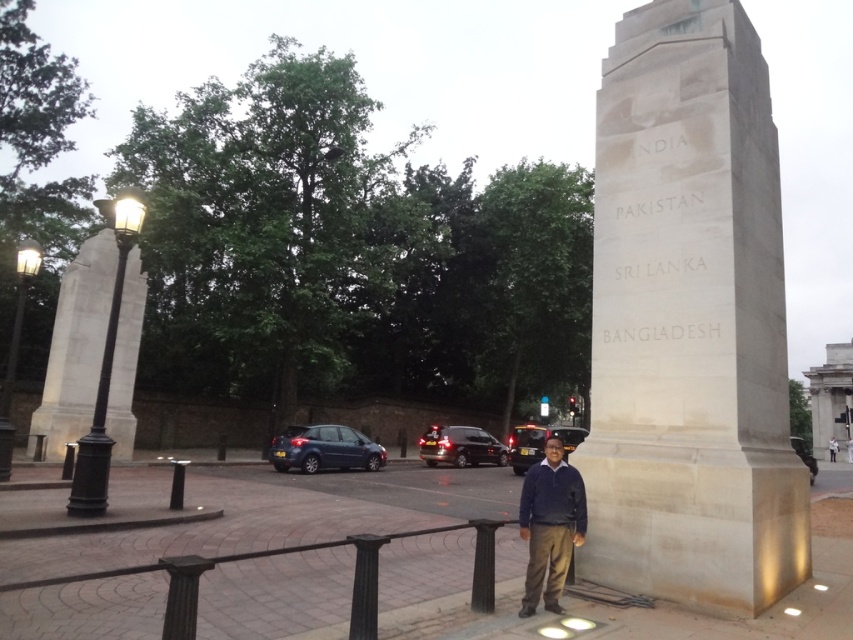
You are a tourist standing at the center of the pedestrian area and want to take a photo of the white stone monument at right. Considering your current position, which direction should you face to capture the monument in your camera frame?

A: Since the white stone monument at right is located at point (689, 321), you should face towards the right side to capture it in your camera frame.

You are standing at the monument and want to take a photo of both the point at coordinates point (85,392) and point (567,515). Which point should you focus on first to ensure both are in the frame?

You should focus on point (85,392) first because it is closer to you than point (567,515), ensuring both points remain in the frame.